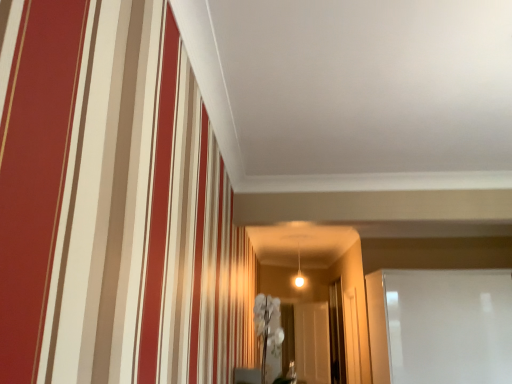
Question: Does white glossy glass door at right, the first glass door when ordered from front to back, have a larger size compared to transparent glass door at center, which appears as the second glass door when viewed from the left?

Choices:
 (A) no
 (B) yes

Answer: (B)

Question: Is white glossy glass door at right, the first glass door when ordered from front to back, oriented away from transparent glass door at center, which appears as the second glass door when viewed from the left?

Choices:
 (A) no
 (B) yes

Answer: (B)

Question: Is white glossy glass door at right, which is counted as the third glass door, starting from the back, wider than transparent glass door at center, placed as the second glass door when sorted from front to back?

Choices:
 (A) yes
 (B) no

Answer: (A)

Question: Would you say white glossy glass door at right, the first glass door when ordered from front to back, is outside transparent glass door at center, placed as the second glass door when sorted from front to back?

Choices:
 (A) yes
 (B) no

Answer: (A)

Question: Is transparent glass door at center, placed as the second glass door when sorted from front to back, surrounded by white glossy glass door at right, which appears as the first glass door when viewed from the right?

Choices:
 (A) yes
 (B) no

Answer: (B)

Question: Is point (342, 362) closer or farther from the camera than point (390, 374)?

Choices:
 (A) closer
 (B) farther

Answer: (B)

Question: Is transparent glass door at center, the second glass door from the right, bigger or smaller than white glossy glass door at right, the first glass door when ordered from front to back?

Choices:
 (A) big
 (B) small

Answer: (B)

Question: Considering the positions of transparent glass door at center, placed as the second glass door when sorted from front to back, and white glossy glass door at right, the third glass door from the left, in the image, is transparent glass door at center, placed as the second glass door when sorted from front to back, taller or shorter than white glossy glass door at right, the third glass door from the left,?

Choices:
 (A) tall
 (B) short

Answer: (A)

Question: From the image's perspective, is transparent glass door at center, which appears as the second glass door when viewed from the left, positioned above or below white glossy glass door at right, the third glass door from the left?

Choices:
 (A) above
 (B) below

Answer: (B)

Question: In the image, is transparent glass door at center, which appears as the second glass door when viewed from the left, on the left side or the right side of transparent glass door at center, which is the 1th glass door in back-to-front order?

Choices:
 (A) right
 (B) left

Answer: (A)

Question: Considering the positions of transparent glass door at center, which appears as the second glass door when viewed from the left, and transparent glass door at center, marked as the third glass door in a front-to-back arrangement, in the image, is transparent glass door at center, which appears as the second glass door when viewed from the left, taller or shorter than transparent glass door at center, marked as the third glass door in a front-to-back arrangement,?

Choices:
 (A) short
 (B) tall

Answer: (B)

Question: Is transparent glass door at center, placed as the second glass door when sorted from front to back, situated inside transparent glass door at center, which is the 1th glass door in back-to-front order, or outside?

Choices:
 (A) outside
 (B) inside

Answer: (A)

Question: From the image's perspective, is transparent glass door at center, the 2th glass door viewed from the back, above or below transparent glass door at center, which is the 1th glass door in back-to-front order?

Choices:
 (A) above
 (B) below

Answer: (A)

Question: From the image's perspective, is transparent glass door at center, marked as the third glass door in a front-to-back arrangement, located above or below transparent glass door at center, the second glass door from the right?

Choices:
 (A) below
 (B) above

Answer: (A)

Question: Is transparent glass door at center, which is the 1th glass door in back-to-front order, to the left or to the right of transparent glass door at center, placed as the second glass door when sorted from front to back, in the image?

Choices:
 (A) left
 (B) right

Answer: (A)